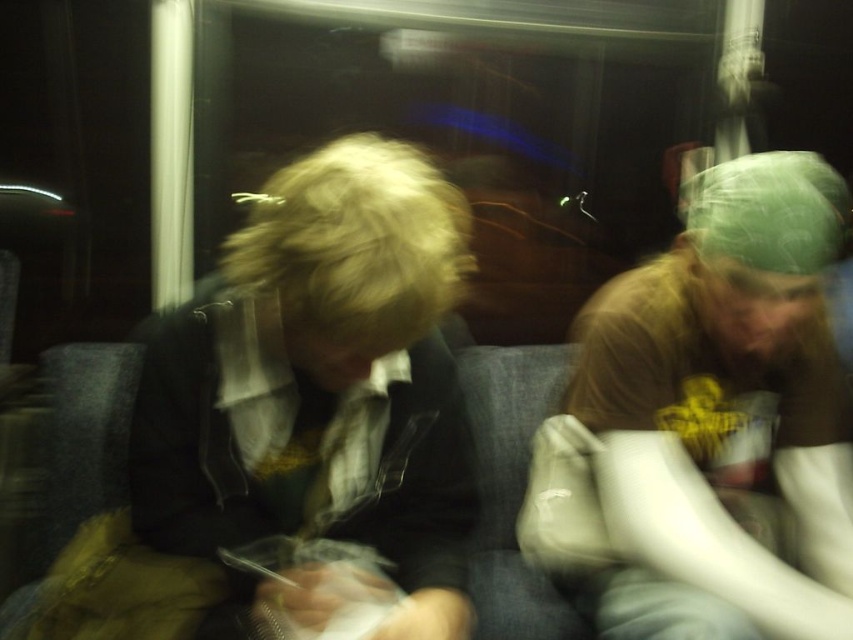
Question: Is green fabric cap at right further to camera compared to matte black jacket at center?

Choices:
 (A) no
 (B) yes

Answer: (B)

Question: Is green fabric cap at right bigger than matte black jacket at center?

Choices:
 (A) yes
 (B) no

Answer: (A)

Question: Is green fabric cap at right in front of matte black jacket at center?

Choices:
 (A) no
 (B) yes

Answer: (A)

Question: Among these points, which one is farthest from the camera?

Choices:
 (A) (140, 451)
 (B) (843, 611)

Answer: (B)